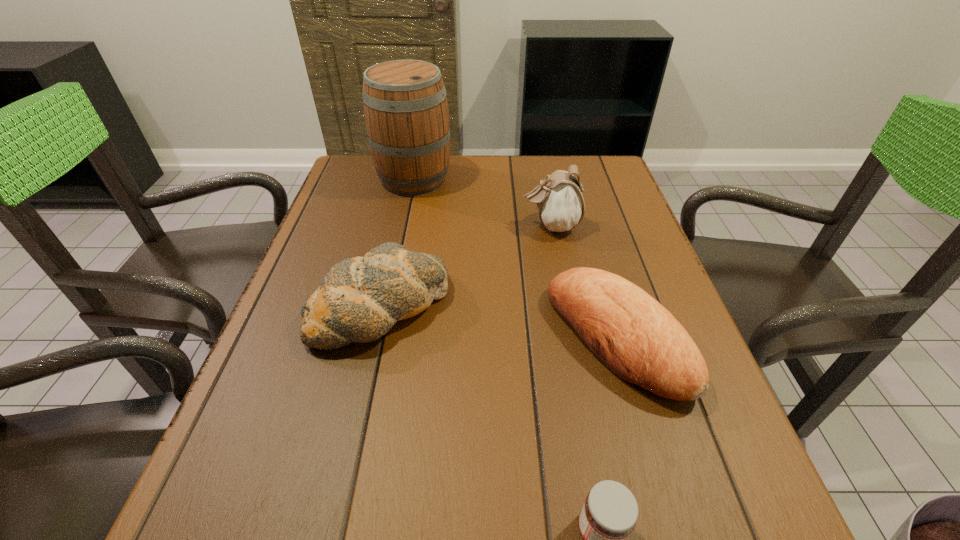
Locate an element on the screen. Image resolution: width=960 pixels, height=540 pixels. free space that satisfies the following two spatial constraints: 1. on the back side of the left bread; 2. on the left side of the farthest object is located at coordinates (410, 178).

The image size is (960, 540). What are the coordinates of `vacant space that satisfies the following two spatial constraints: 1. on the front side of the taller bread; 2. on the left side of the right bread` in the screenshot? It's located at (374, 338).

Where is `vacant point that satisfies the following two spatial constraints: 1. on the back side of the right bread; 2. on the front-facing side of the pouch`? vacant point that satisfies the following two spatial constraints: 1. on the back side of the right bread; 2. on the front-facing side of the pouch is located at coordinates (584, 226).

This screenshot has width=960, height=540. In order to click on free space that satisfies the following two spatial constraints: 1. on the front-facing side of the shorter bread; 2. on the right side of the pouch in this screenshot , I will do `click(572, 338)`.